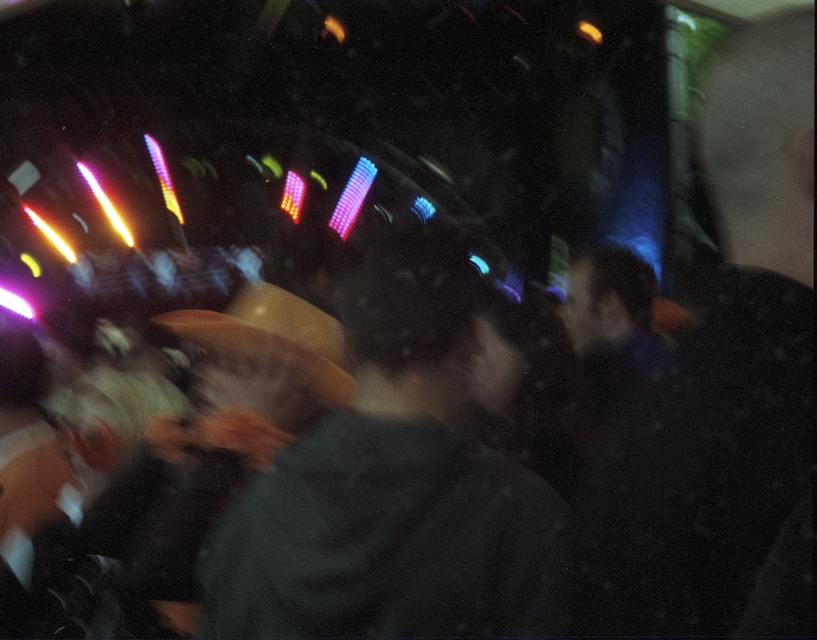
At what (x,y) coordinates should I click in order to perform the action: click on dark gray shirt at right. Please return your answer as a coordinate pair (x, y). Image resolution: width=817 pixels, height=640 pixels. Looking at the image, I should click on (724, 387).

Is dark gray shirt at right behind dark gray sweater at center?

No, dark gray shirt at right is in front of dark gray sweater at center.

Identify the location of dark gray shirt at right. (724, 387).